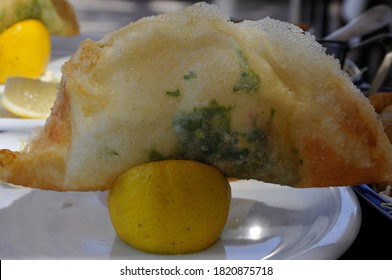
This screenshot has height=280, width=392. In order to click on inside of white plate in this screenshot , I will do `click(293, 224)`, `click(73, 225)`.